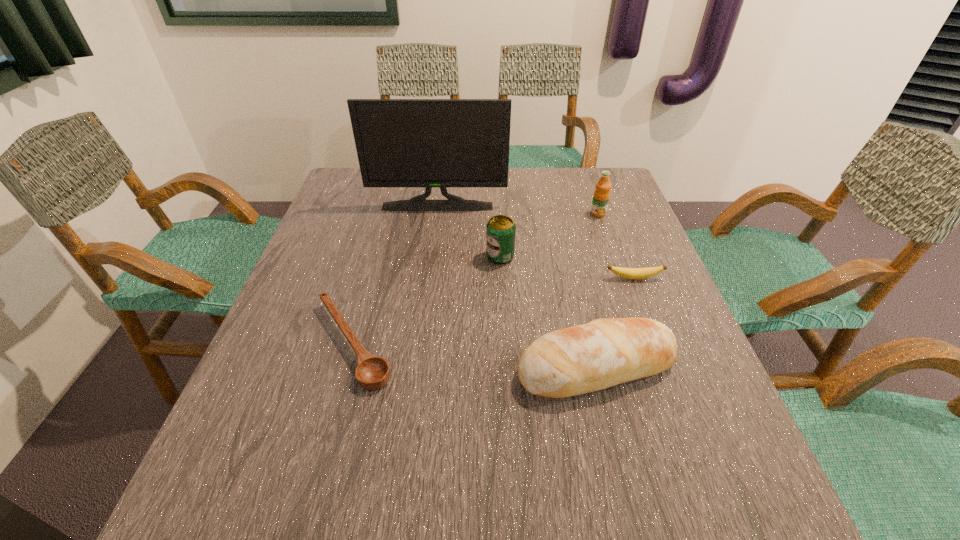
At what (x,y) coordinates should I click in order to perform the action: click on unoccupied position between the beer can and the wooden spoon. Please return your answer as a coordinate pair (x, y). The width and height of the screenshot is (960, 540). Looking at the image, I should click on (426, 300).

Locate an element on the screen. This screenshot has width=960, height=540. free space between the second tallest object and the tallest object is located at coordinates point(517,210).

This screenshot has width=960, height=540. Identify the location of free space between the orange juice and the third nearest object. (616, 246).

Locate an element on the screen. This screenshot has width=960, height=540. vacant area between the orange juice and the tallest object is located at coordinates (517, 210).

Where is `object that is the fourth closest to the beer can`? This screenshot has height=540, width=960. object that is the fourth closest to the beer can is located at coordinates (372, 372).

Find the location of a particular element. object that ranks as the closest to the third nearest object is located at coordinates (580, 359).

At what (x,y) coordinates should I click in order to perform the action: click on vacant space that satisfies the following two spatial constraints: 1. on the back side of the wooden spoon; 2. on the right side of the third nearest object. Please return your answer as a coordinate pair (x, y). Looking at the image, I should click on (371, 278).